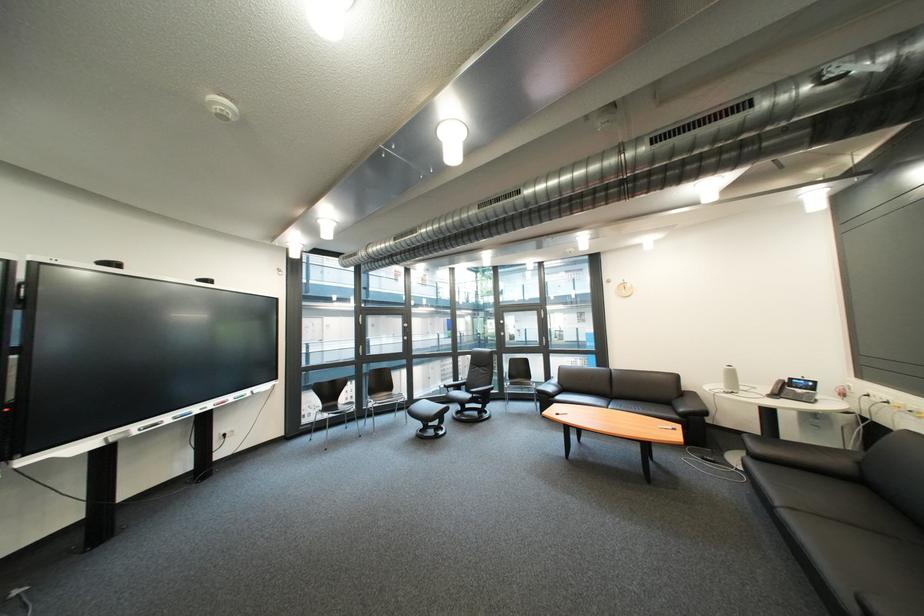
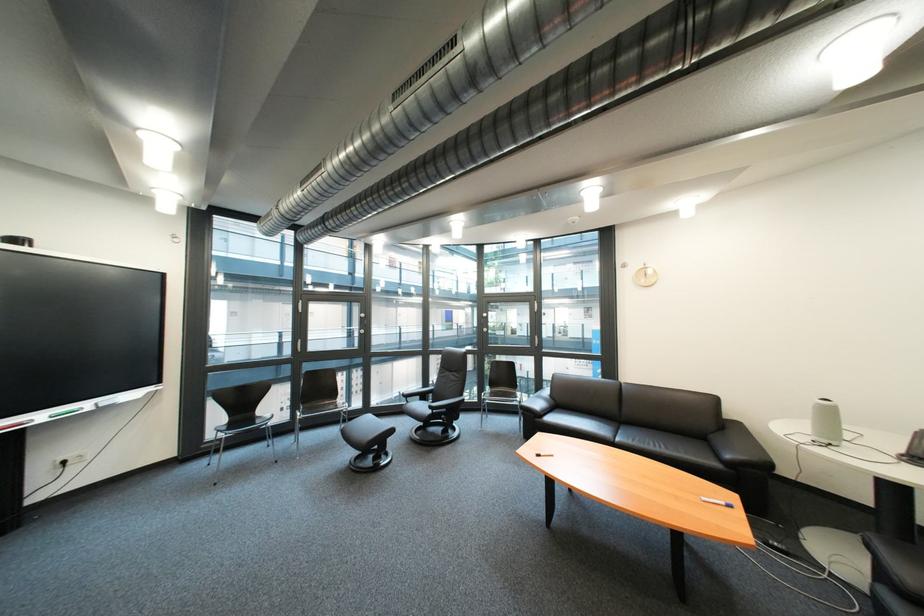
In the second image, find the point that corresponds to point (261, 394) in the first image.

(101, 406)